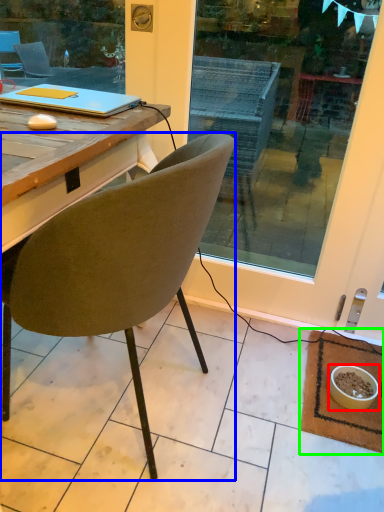
Question: Considering the real-world distances, which object is closest to bowl (highlighted by a red box)? chair (highlighted by a blue box) or mat (highlighted by a green box).

Choices:
 (A) chair
 (B) mat

Answer: (B)